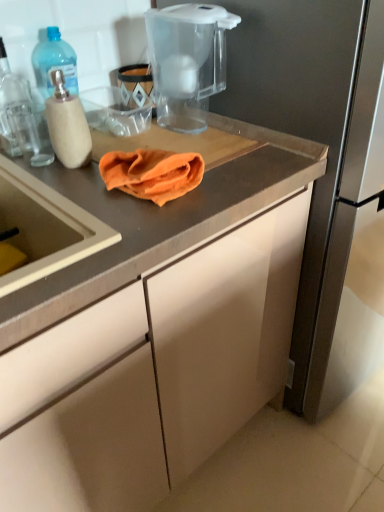
Question: From the image's perspective, would you say translucent plastic bottle at left is positioned over transparent plastic water filter pitcher at upper center?

Choices:
 (A) no
 (B) yes

Answer: (A)

Question: Does translucent plastic bottle at left have a greater height compared to transparent plastic water filter pitcher at upper center?

Choices:
 (A) yes
 (B) no

Answer: (B)

Question: From the image's perspective, is translucent plastic bottle at left beneath transparent plastic water filter pitcher at upper center?

Choices:
 (A) no
 (B) yes

Answer: (B)

Question: Is translucent plastic bottle at left further to camera compared to transparent plastic water filter pitcher at upper center?

Choices:
 (A) no
 (B) yes

Answer: (B)

Question: Is transparent plastic water filter pitcher at upper center a part of translucent plastic bottle at left?

Choices:
 (A) yes
 (B) no

Answer: (B)

Question: Relative to orange cloth at center, is transparent plastic water filter pitcher at upper center in front or behind?

Choices:
 (A) front
 (B) behind

Answer: (B)

Question: Do you think transparent plastic water filter pitcher at upper center is within orange cloth at center, or outside of it?

Choices:
 (A) outside
 (B) inside

Answer: (A)

Question: Looking at the image, does transparent plastic water filter pitcher at upper center seem bigger or smaller compared to orange cloth at center?

Choices:
 (A) small
 (B) big

Answer: (B)

Question: Considering the relative positions of transparent plastic water filter pitcher at upper center and orange cloth at center in the image provided, is transparent plastic water filter pitcher at upper center to the left or to the right of orange cloth at center?

Choices:
 (A) left
 (B) right

Answer: (B)

Question: In terms of height, does matte gray cabinet at center look taller or shorter compared to orange cloth at center?

Choices:
 (A) short
 (B) tall

Answer: (B)

Question: From the image's perspective, is matte gray cabinet at center located above or below orange cloth at center?

Choices:
 (A) above
 (B) below

Answer: (B)

Question: Is point (117, 467) closer or farther from the camera than point (158, 202)?

Choices:
 (A) farther
 (B) closer

Answer: (A)

Question: Is matte gray cabinet at center situated inside orange cloth at center or outside?

Choices:
 (A) inside
 (B) outside

Answer: (B)

Question: From a real-world perspective, is orange cloth at center positioned above or below matte gray cabinet at center?

Choices:
 (A) above
 (B) below

Answer: (A)

Question: From the image's perspective, relative to matte gray cabinet at center, is orange cloth at center above or below?

Choices:
 (A) above
 (B) below

Answer: (A)